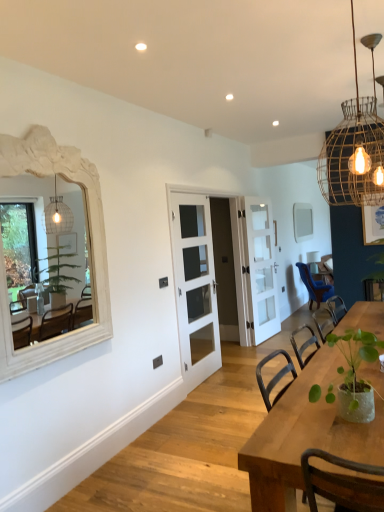
This screenshot has width=384, height=512. Find the location of `free point above white carved wood mirror at left, which ranks as the 2th mirror in back-to-front order (from a real-world perspective)`. free point above white carved wood mirror at left, which ranks as the 2th mirror in back-to-front order (from a real-world perspective) is located at coordinates (47, 129).